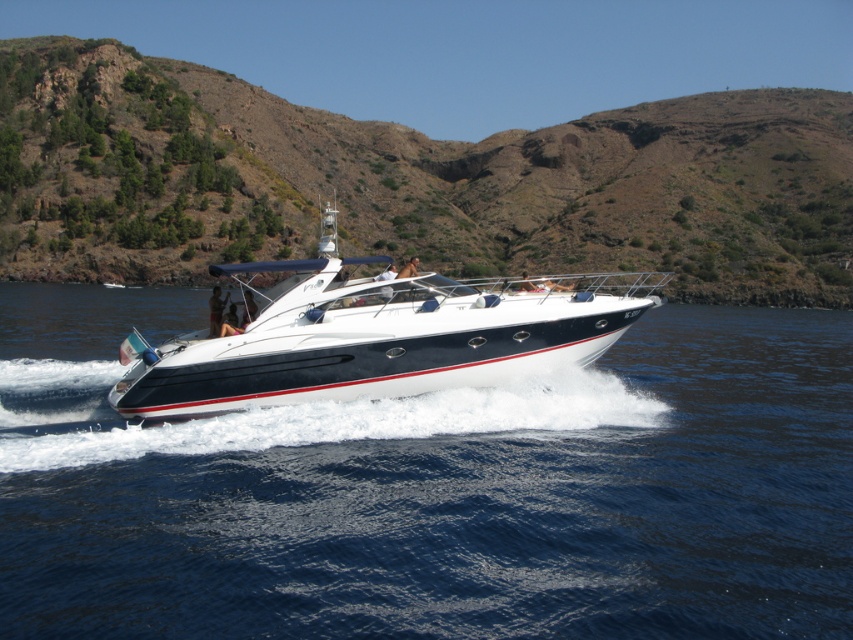
Is brown/dry grass hillside at upper center taller than white glossy boat at center?

Yes.

Based on the photo, does brown/dry grass hillside at upper center appear on the left side of white glossy boat at center?

Incorrect, brown/dry grass hillside at upper center is not on the left side of white glossy boat at center.

Describe the element at coordinates (413, 180) in the screenshot. The width and height of the screenshot is (853, 640). I see `brown/dry grass hillside at upper center` at that location.

Identify the location of brown/dry grass hillside at upper center. The image size is (853, 640). (413, 180).

Which of these two, blue liquid water at center or white glossy boat at center, stands taller?

white glossy boat at center is taller.

Locate an element on the screen. This screenshot has height=640, width=853. blue liquid water at center is located at coordinates (468, 502).

Can you confirm if blue liquid water at center is positioned to the right of brown/dry grass hillside at upper center?

No, blue liquid water at center is not to the right of brown/dry grass hillside at upper center.

The width and height of the screenshot is (853, 640). Describe the element at coordinates (468, 502) in the screenshot. I see `blue liquid water at center` at that location.

The height and width of the screenshot is (640, 853). In order to click on blue liquid water at center in this screenshot , I will do `click(468, 502)`.